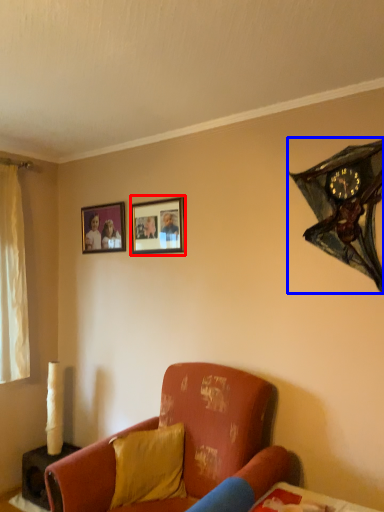
Question: Which of the following is the farthest to the observer, picture frame (highlighted by a red box) or clock (highlighted by a blue box)?

Choices:
 (A) picture frame
 (B) clock

Answer: (A)